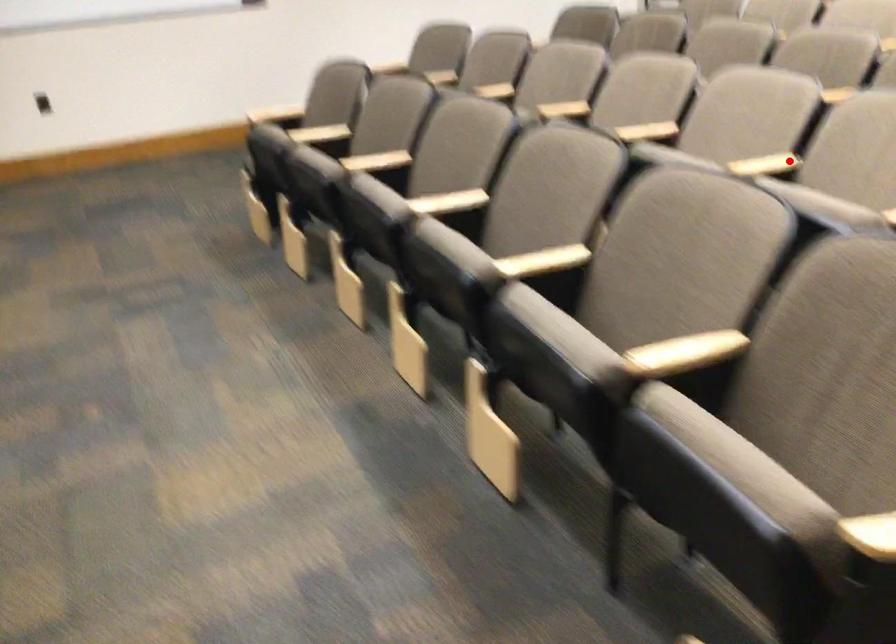
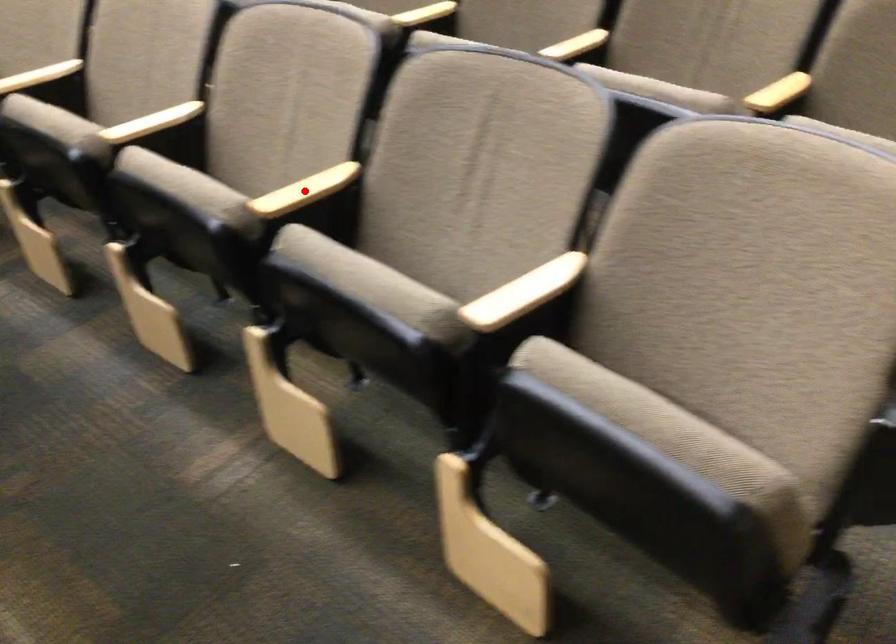
I am providing you with two images of the same scene from different viewpoints. A red point is marked on the first image and another point is marked on the second image. Is the red point in image1 aligned with the point shown in image2?

No